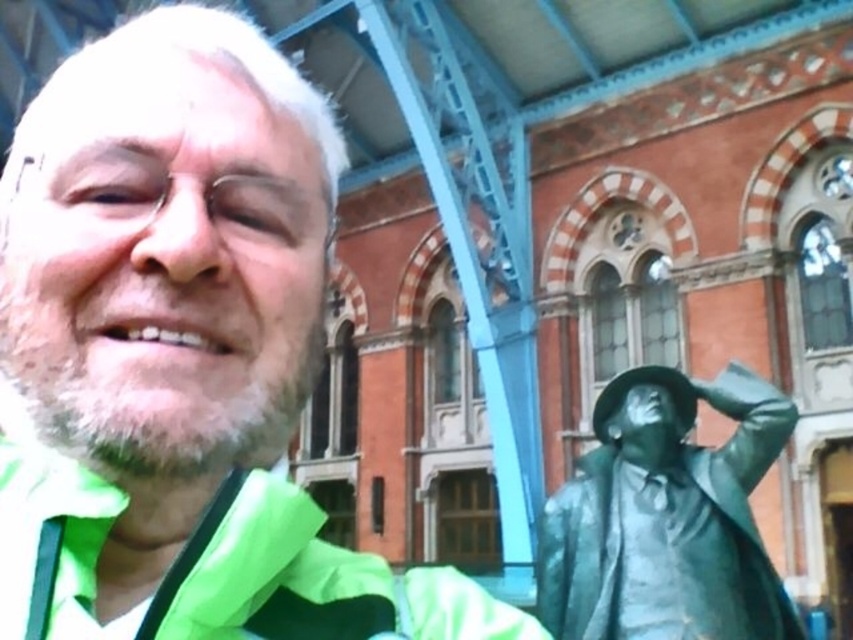
Question: Which point is closer to the camera taking this photo?

Choices:
 (A) (218, 634)
 (B) (680, 602)
 (C) (96, 241)

Answer: (A)

Question: Is green matte jacket at left smaller than green fabric jacket at left?

Choices:
 (A) no
 (B) yes

Answer: (A)

Question: Can you confirm if green fabric jacket at left is wider than bronze statue at right?

Choices:
 (A) no
 (B) yes

Answer: (B)

Question: Is green fabric jacket at left thinner than bronze statue at right?

Choices:
 (A) no
 (B) yes

Answer: (A)

Question: Based on their relative distances, which object is nearer to the bronze statue at right?

Choices:
 (A) green matte jacket at left
 (B) green fabric jacket at left

Answer: (B)

Question: Among these objects, which one is nearest to the camera?

Choices:
 (A) green fabric jacket at left
 (B) green matte jacket at left
 (C) bronze statue at right

Answer: (A)